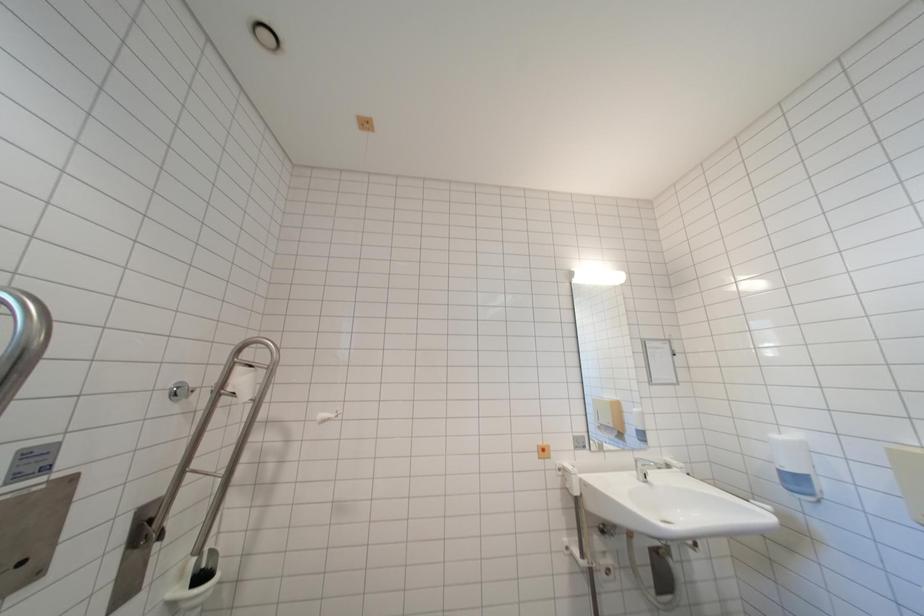
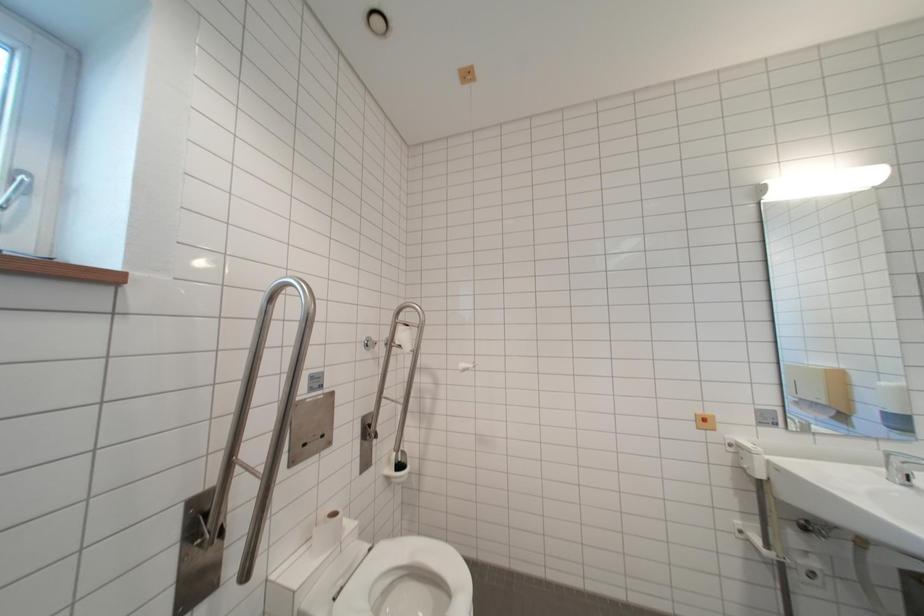
Question: Based on the continuous images, in which direction is the camera rotating? Reply with the corresponding letter.

Choices:
 (A) Left
 (B) Right
 (C) Up
 (D) Down

Answer: (A)